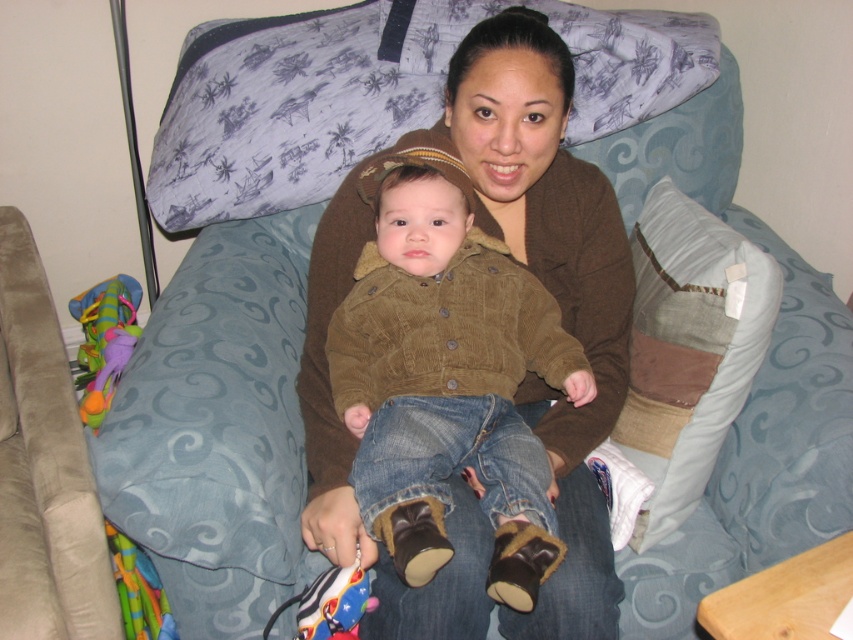
Question: Considering the relative positions of brown corduroy jacket at center and patchwork fabric pillow at right in the image provided, where is brown corduroy jacket at center located with respect to patchwork fabric pillow at right?

Choices:
 (A) right
 (B) left

Answer: (B)

Question: Does brown corduroy jacket at center appear over patchwork fabric pillow at right?

Choices:
 (A) yes
 (B) no

Answer: (B)

Question: Which point is farther from the camera taking this photo?

Choices:
 (A) (468, 280)
 (B) (689, 209)

Answer: (B)

Question: Which object appears closest to the camera in this image?

Choices:
 (A) brown corduroy jacket at center
 (B) patchwork fabric pillow at right

Answer: (A)

Question: Does brown corduroy jacket at center lie in front of patchwork fabric pillow at right?

Choices:
 (A) no
 (B) yes

Answer: (B)